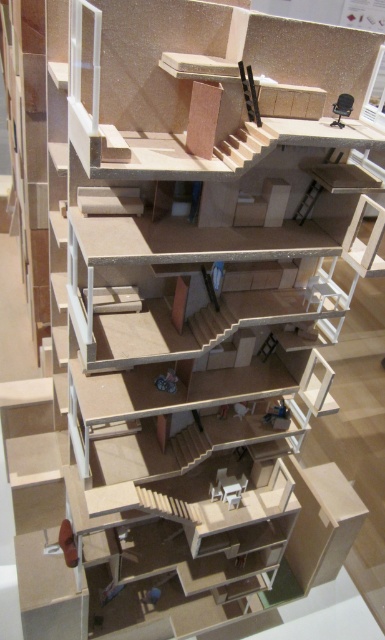
Question: Estimate the real-world distances between objects in this image. Which object is farther from the wooden staircase at center?

Choices:
 (A) wooden at center
 (B) wooden stairs at upper center

Answer: (B)

Question: Does wooden at center have a smaller size compared to wooden staircase at center?

Choices:
 (A) yes
 (B) no

Answer: (A)

Question: Observing the image, what is the correct spatial positioning of wooden stairs at upper center in reference to wooden at center?

Choices:
 (A) below
 (B) above

Answer: (B)

Question: Estimate the real-world distances between objects in this image. Which object is closer to the wooden stairs at upper center?

Choices:
 (A) wooden at center
 (B) wooden staircase at center

Answer: (A)

Question: Which object appears closest to the camera in this image?

Choices:
 (A) wooden staircase at center
 (B) wooden at center

Answer: (B)

Question: Does wooden stairs at upper center appear on the right side of wooden at center?

Choices:
 (A) yes
 (B) no

Answer: (A)